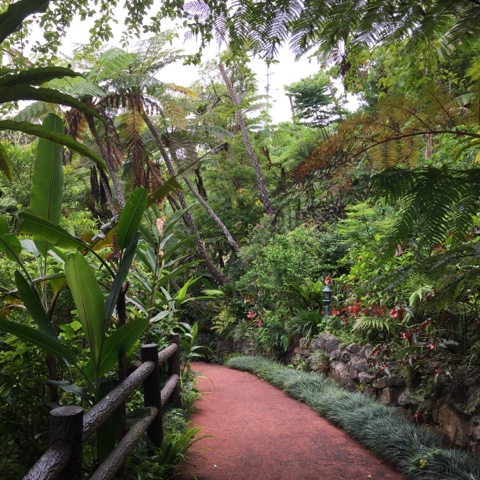
The width and height of the screenshot is (480, 480). Identify the location of plant. click(86, 301).